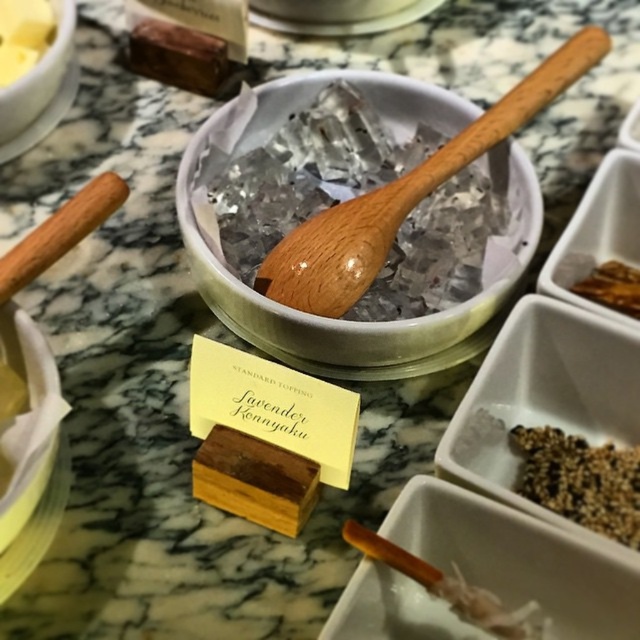
Does white ceramic bowl at upper left lie in front of brown crispy snack at upper right?

No, it is not.

Between point (67, 49) and point (611, 284), which one is positioned behind?

Positioned behind is point (67, 49).

Locate an element on the screen. This screenshot has height=640, width=640. white ceramic bowl at upper left is located at coordinates (36, 76).

Is wooden spoon at center thinner than brown textured grain at lower right?

Incorrect, wooden spoon at center's width is not less than brown textured grain at lower right's.

Who is more distant from viewer, (321, 83) or (605, 536)?

The point (321, 83) is behind.

Does point (426, 365) come closer to viewer compared to point (637, 508)?

No, it is behind (637, 508).

The image size is (640, 640). I want to click on wooden spoon at center, so click(x=353, y=321).

Which is below, yellow butter at upper left or brown crispy snack at upper right?

brown crispy snack at upper right is lower down.

Between yellow butter at upper left and brown crispy snack at upper right, which one appears on the left side from the viewer's perspective?

From the viewer's perspective, yellow butter at upper left appears more on the left side.

Is point (3, 38) positioned in front of point (609, 269)?

No, (3, 38) is further to viewer.

This screenshot has width=640, height=640. In order to click on yellow butter at upper left in this screenshot , I will do click(x=22, y=35).